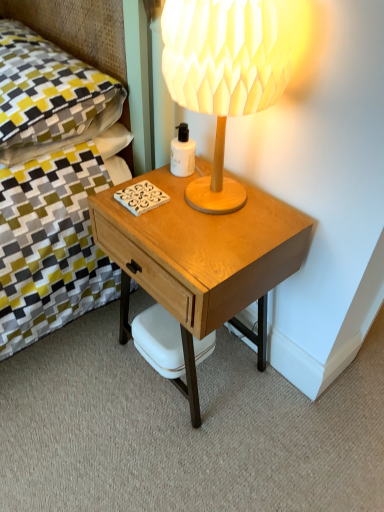
Question: Looking at the image, does light brown wood desk at center seem bigger or smaller compared to wooden lampshade at upper right?

Choices:
 (A) small
 (B) big

Answer: (B)

Question: From a real-world perspective, is light brown wood desk at center physically located above or below wooden lampshade at upper right?

Choices:
 (A) above
 (B) below

Answer: (B)

Question: Based on their relative distances, which object is farther from the yellow-green fabric pillow at upper left?

Choices:
 (A) light brown wood desk at center
 (B) wooden lampshade at upper right
 (C) white matte coffee cup at lower center
 (D) white matte bottle at center

Answer: (C)

Question: Estimate the real-world distances between objects in this image. Which object is closer to the yellow-green fabric pillow at upper left?

Choices:
 (A) white matte bottle at center
 (B) light brown wood desk at center
 (C) wooden lampshade at upper right
 (D) white matte coffee cup at lower center

Answer: (A)